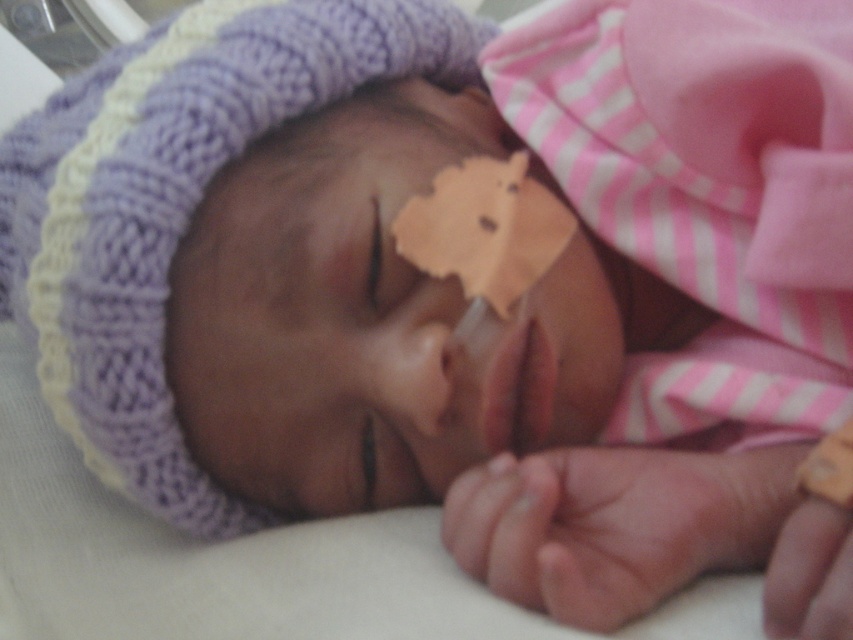
Based on the scene description, which object is taller, the pink smooth skin at lower right or the smooth skin nose at center?

The pink smooth skin at lower right is taller than the smooth skin nose at center.

You are a nurse checking on a newborn baby. You need to administer a small injection in the arm. The injection site must be at least 14 inches away from the baby to ensure safety. Based on the image, can you safely administer the injection in the pink smooth skin at lower right?

The pink smooth skin at lower right is 13.82 inches away from the viewer, which is less than the required 14 inches. Therefore, the injection cannot be safely administered here.